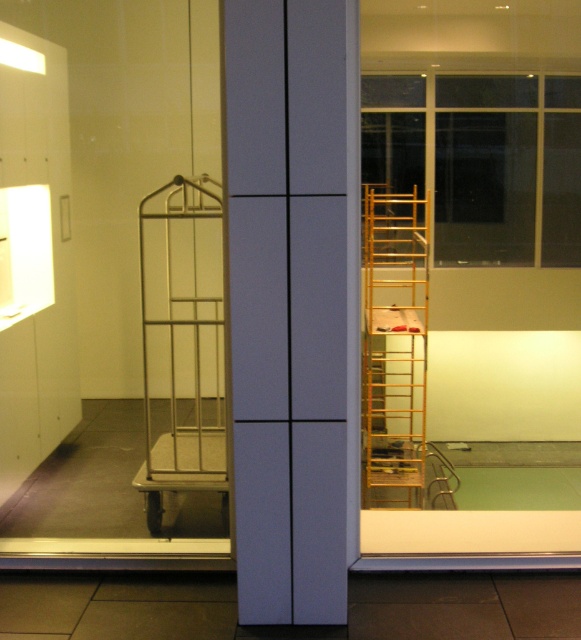
Does white matte cabinet at center have a smaller size compared to gold metallic ladder at right?

Yes.

Which of these two, white matte cabinet at center or gold metallic ladder at right, stands taller?

Standing taller between the two is gold metallic ladder at right.

Does point (332, 166) lie in front of point (368, 364)?

Yes, point (332, 166) is closer to viewer.

Identify the location of white matte cabinet at center. (288, 305).

Between point (173, 304) and point (426, 237), which one is positioned in front?

Positioned in front is point (173, 304).

Who is positioned more to the left, silver metallic cart at left or gold metallic ladder at right?

Positioned to the left is silver metallic cart at left.

Which is in front, point (160, 493) or point (378, 458)?

Point (160, 493) is more forward.

Where is `silver metallic cart at left`? silver metallic cart at left is located at coordinates (182, 342).

Does white matte cabinet at center appear on the left side of silver metallic cart at left?

No, white matte cabinet at center is not to the left of silver metallic cart at left.

How distant is white matte cabinet at center from silver metallic cart at left?

The distance of white matte cabinet at center from silver metallic cart at left is 1.42 meters.

Find the location of a particular element. The height and width of the screenshot is (640, 581). white matte cabinet at center is located at coordinates (288, 305).